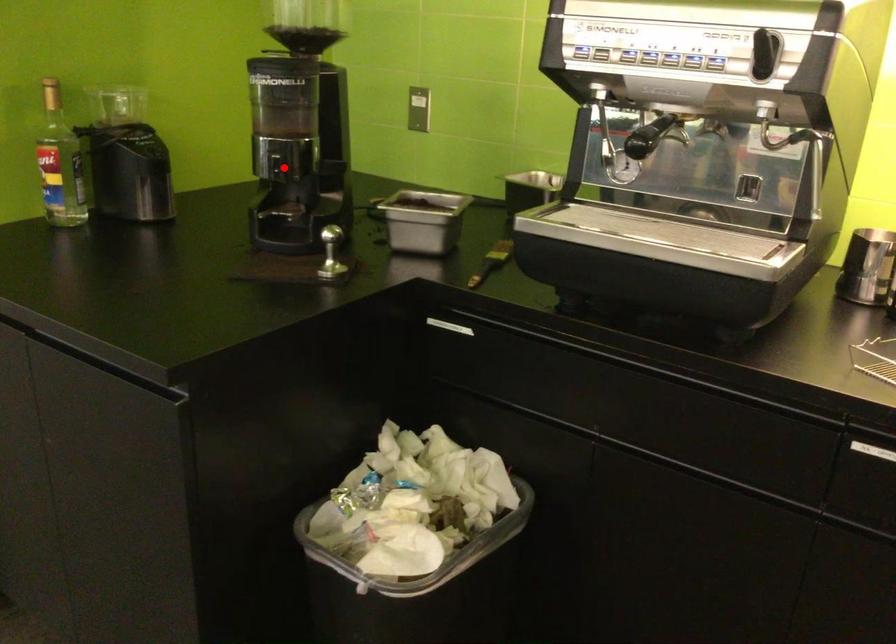
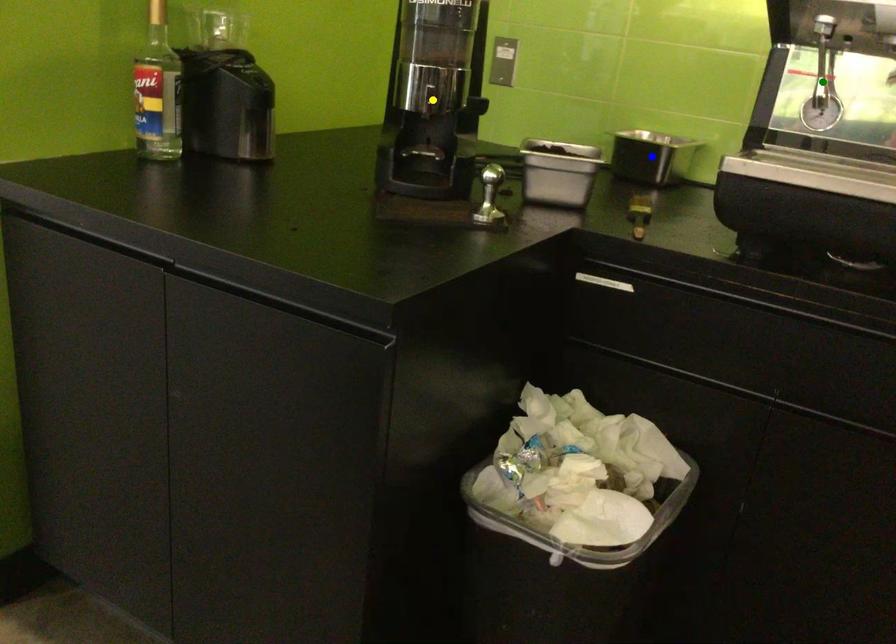
Question: I am providing you with two images of the same scene from different viewpoints. A red point is marked on the first image. You are given multiple points on the second image. Which point in image 2 represents the same 3d spot as the red point in image 1?

Choices:
 (A) green point
 (B) blue point
 (C) yellow point

Answer: (C)